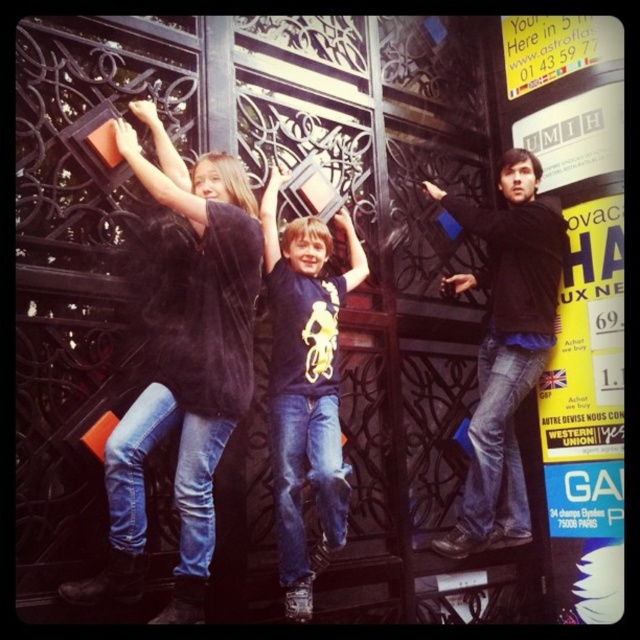
Which is behind, point (490, 388) or point (320, 397)?

The point (490, 388) is more distant.

Is point (499, 365) less distant than point (269, 275)?

No, (499, 365) is behind (269, 275).

This screenshot has height=640, width=640. What are the coordinates of `matte black shirt at right` in the screenshot? It's located at [x=506, y=346].

Can you confirm if velvet black coat at left is wider than matte black shirt at right?

No, velvet black coat at left is not wider than matte black shirt at right.

Does velvet black coat at left have a larger size compared to matte black shirt at right?

Incorrect, velvet black coat at left is not larger than matte black shirt at right.

Consider the image. Who is more forward, (225, 416) or (493, 273)?

Point (225, 416) is more forward.

Find the location of a particular element. The width and height of the screenshot is (640, 640). velvet black coat at left is located at coordinates (184, 371).

From the picture: Who is more distant from viewer, (200,211) or (336,460)?

The point (336,460) is more distant.

Image resolution: width=640 pixels, height=640 pixels. What do you see at coordinates (184, 371) in the screenshot?
I see `velvet black coat at left` at bounding box center [184, 371].

Locate an element on the screen. velvet black coat at left is located at coordinates (184, 371).